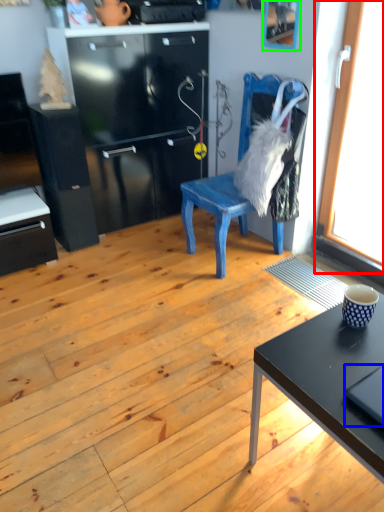
Question: Which object is the closest to the window (highlighted by a red box)? Choose among these: laptop (highlighted by a blue box) or picture frame (highlighted by a green box).

Choices:
 (A) laptop
 (B) picture frame

Answer: (B)